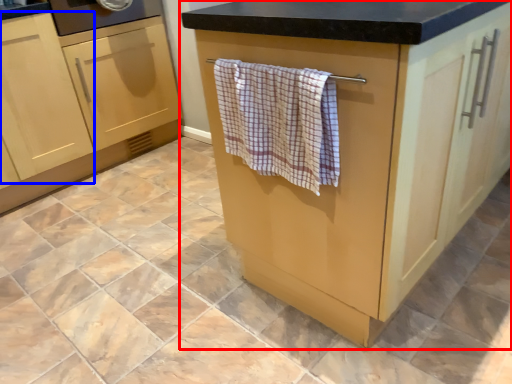
Question: Which object appears closest to the camera in this image, cabinetry (highlighted by a red box) or cabinetry (highlighted by a blue box)?

Choices:
 (A) cabinetry
 (B) cabinetry

Answer: (A)